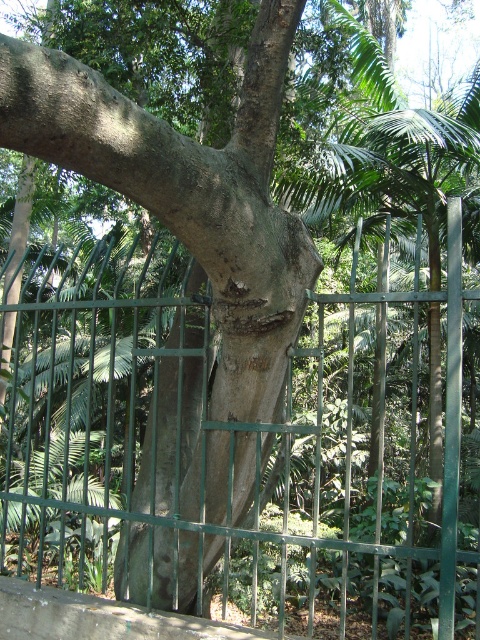
Question: Where is green metal fence at center located in relation to smooth gray bark at center in the image?

Choices:
 (A) above
 (B) below

Answer: (B)

Question: Among these points, which one is farthest from the camera?

Choices:
 (A) (36, 580)
 (B) (216, 300)

Answer: (A)

Question: Is green metal fence at center to the left of smooth gray bark at center from the viewer's perspective?

Choices:
 (A) yes
 (B) no

Answer: (A)

Question: Does green metal fence at center lie in front of smooth gray bark at center?

Choices:
 (A) yes
 (B) no

Answer: (A)

Question: Which point is farther from the camera taking this photo?

Choices:
 (A) (312, 333)
 (B) (144, 540)

Answer: (A)

Question: Which object is closer to the camera taking this photo?

Choices:
 (A) green metal fence at center
 (B) smooth gray bark at center

Answer: (A)